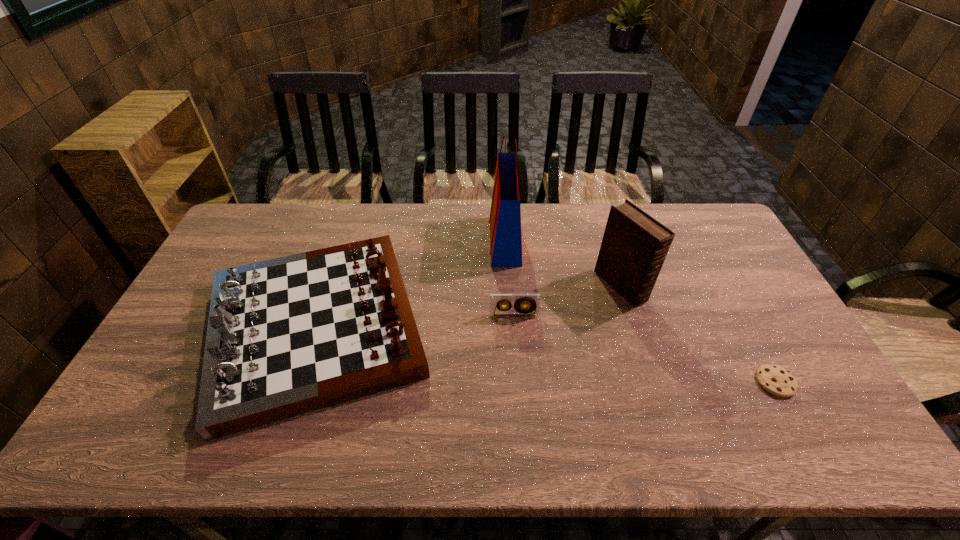
Find the location of `vacant space situated 0.150m on the handle side of the shopping bag`. vacant space situated 0.150m on the handle side of the shopping bag is located at coordinates (446, 241).

You are a GUI agent. You are given a task and a screenshot of the screen. Output one action in this format:
    pyautogui.click(x=<x>, y=<y>)
    Task: Click on the free region located on the front of the fourth shortest object
    
    Given the screenshot: What is the action you would take?
    pyautogui.click(x=660, y=408)

Locate an element on the screen. Image resolution: width=960 pixels, height=540 pixels. free space located 0.200m on the right of the gameboard is located at coordinates (504, 327).

Image resolution: width=960 pixels, height=540 pixels. I want to click on blank space located 0.120m at the front of the fourth tallest object with visible reels, so click(x=516, y=352).

Identify the location of vacant space located 0.100m on the back of the cookie. Image resolution: width=960 pixels, height=540 pixels. (751, 337).

In order to click on object present at the far edge in this screenshot , I will do `click(505, 216)`.

This screenshot has height=540, width=960. What are the coordinates of `object located in the near edge section of the desktop` in the screenshot? It's located at (287, 336).

At what (x,y) coordinates should I click in order to perform the action: click on object that is at the left edge. Please return your answer as a coordinate pair (x, y). Looking at the image, I should click on (287, 336).

What are the coordinates of `object at the right edge` in the screenshot? It's located at click(776, 380).

Locate an element on the screen. The height and width of the screenshot is (540, 960). object that is positioned at the near left corner is located at coordinates (287, 336).